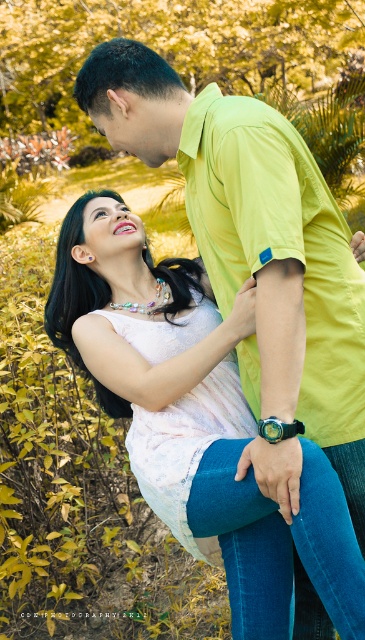
You are an artist sketching the scene. You need to decide which object to draw first based on their size. Which one should you start with, the matte white blouse at center or the matte black forehead at upper center?

The matte white blouse at center might be wider than matte black forehead at upper center, so you should start with the matte white blouse at center since it is likely larger.

You are an artist sketching this scene and need to ensure proportions are accurate. Which object is larger in size between the matte white blouse at center and the matte black forehead at upper center?

The matte white blouse at center is larger than the matte black forehead at upper center.